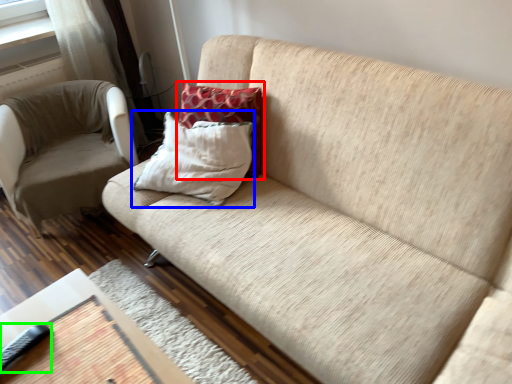
Question: Based on their relative distances, which object is farther from pillow (highlighted by a red box)? Choose from pillow (highlighted by a blue box) and remote (highlighted by a green box).

Choices:
 (A) pillow
 (B) remote

Answer: (B)